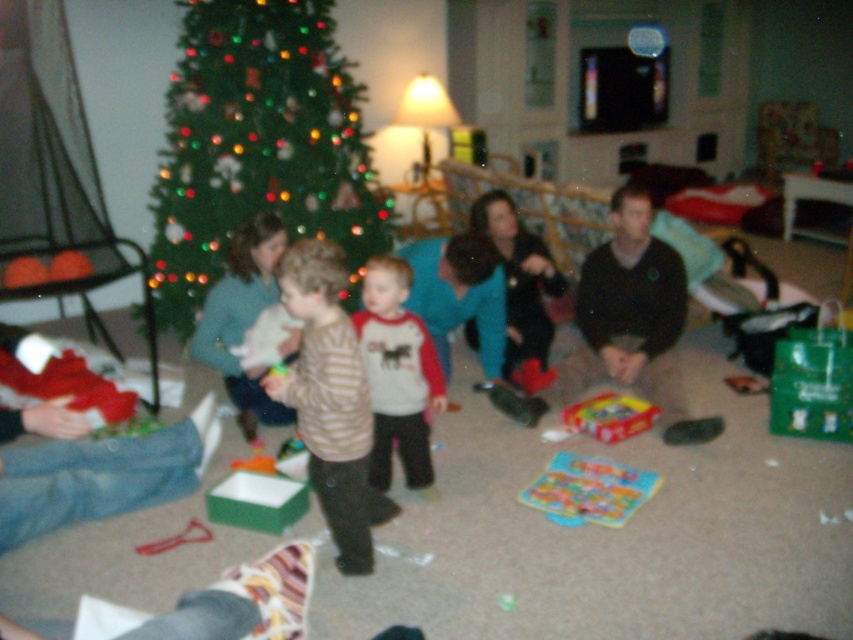
Question: Is striped sweater at center to the left of matte plastic board game at lower center from the viewer's perspective?

Choices:
 (A) yes
 (B) no

Answer: (A)

Question: Which object is closer to the camera taking this photo?

Choices:
 (A) matte plastic board game at lower center
 (B) striped sweater at center
 (C) green matte christmas tree at upper left
 (D) striped cotton shirt at center

Answer: (B)

Question: Which point is farther to the camera?

Choices:
 (A) 578,458
 (B) 595,268
 (C) 421,432

Answer: (B)

Question: Which of these objects is positioned closest to the black sweater at center?

Choices:
 (A) striped cotton shirt at center
 (B) green matte christmas tree at upper left
 (C) striped sweater at center

Answer: (A)

Question: Does black sweater at center appear on the left side of matte plastic board game at lower center?

Choices:
 (A) no
 (B) yes

Answer: (A)

Question: Does black sweater at center have a greater width compared to matte plastic board game at lower center?

Choices:
 (A) no
 (B) yes

Answer: (B)